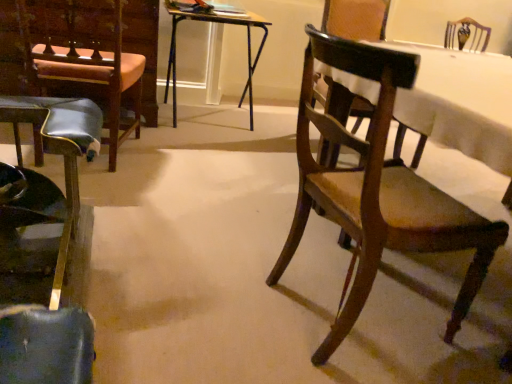
Question: Is leather seat at left, the second armchair viewed from the right, inside or outside of wooden chair at right, positioned as the 2th chair in left-to-right order?

Choices:
 (A) inside
 (B) outside

Answer: (B)

Question: Is leather seat at left, the first armchair positioned from the left, in front of or behind wooden chair at right, positioned as the 2th chair in left-to-right order, in the image?

Choices:
 (A) behind
 (B) front

Answer: (A)

Question: Which of these objects is positioned farthest from the wooden folding table at center?

Choices:
 (A) wooden chair at right, positioned as the 2th chair in left-to-right order
 (B) wooden chair at right, the 1th armchair from the right
 (C) shiny black stool at left, placed as the 2th chair when sorted from right to left
 (D) leather seat at left, the first armchair positioned from the left

Answer: (A)

Question: Which object is the closest to the wooden chair at right, positioned as the 2th chair in left-to-right order?

Choices:
 (A) shiny black stool at left, the 1th chair when ordered from left to right
 (B) wooden chair at right, the second armchair viewed from the left
 (C) wooden folding table at center
 (D) leather seat at left, the second armchair viewed from the right

Answer: (A)